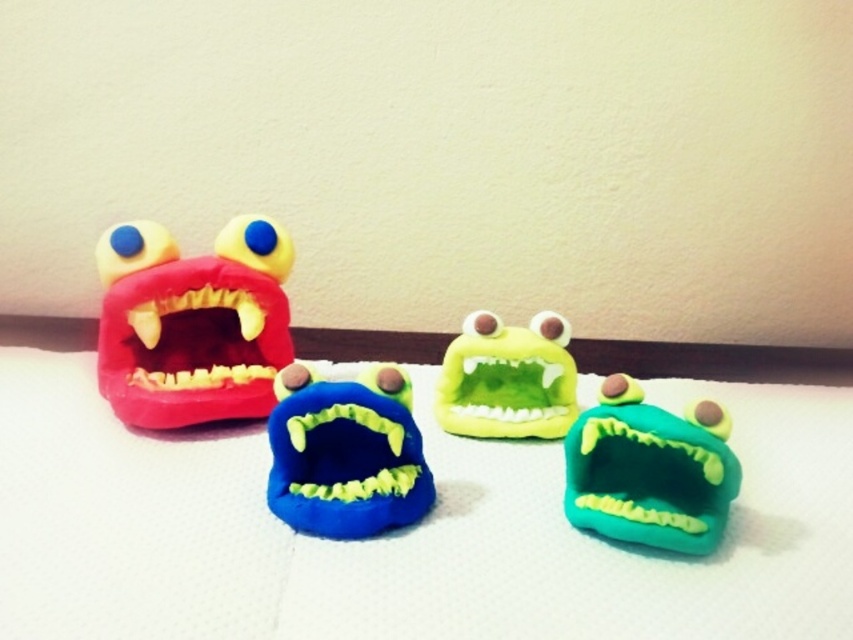
Between green matte toy at center and matte plastic mouth at left, which one has less height?

With less height is matte plastic mouth at left.

Is green matte toy at center bigger than matte plastic mouth at left?

Indeed, green matte toy at center has a larger size compared to matte plastic mouth at left.

Does point (720, 518) come farther from viewer compared to point (160, 371)?

No, it is in front of (160, 371).

You are a GUI agent. You are given a task and a screenshot of the screen. Output one action in this format:
    pyautogui.click(x=<x>, y=<y>)
    Task: Click on the green matte toy at center
    The width and height of the screenshot is (853, 640).
    Given the screenshot: What is the action you would take?
    pyautogui.click(x=650, y=470)

Who is positioned more to the right, matte plastic monster at left or green matte plush toy at center?

green matte plush toy at center is more to the right.

Is matte plastic monster at left positioned before green matte plush toy at center?

Yes, matte plastic monster at left is closer to the viewer.

Who is more distant from viewer, (x=206, y=289) or (x=469, y=384)?

Point (x=469, y=384)

Where is `matte plastic monster at left`? matte plastic monster at left is located at coordinates (192, 323).

Is blue fuzzy monster at center to the left of green matte plush toy at center from the viewer's perspective?

Yes, blue fuzzy monster at center is to the left of green matte plush toy at center.

Find the location of a particular element. This screenshot has height=640, width=853. blue fuzzy monster at center is located at coordinates coord(346,452).